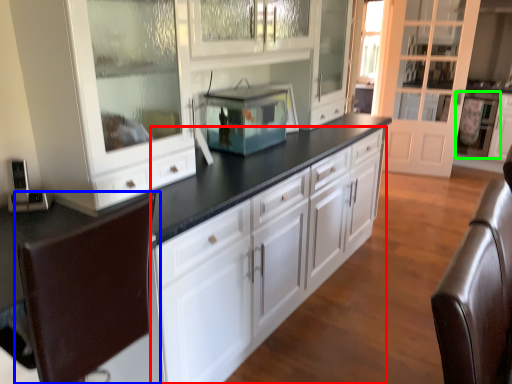
Question: Which object is positioned closest to cabinetry (highlighted by a red box)? Select from swivel chair (highlighted by a blue box) and appliance (highlighted by a green box).

Choices:
 (A) swivel chair
 (B) appliance

Answer: (A)